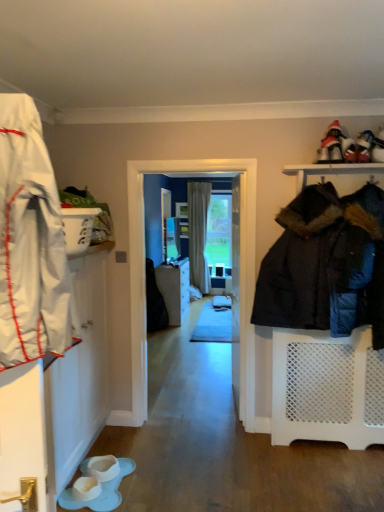
What do you see at coordinates (31, 243) in the screenshot?
I see `white fabric coat at left` at bounding box center [31, 243].

Measure the distance between point (289, 408) and camera.

The distance of point (289, 408) from camera is 9.93 feet.

Find the location of a particular element. This screenshot has height=512, width=384. dark blue quilted jacket at right is located at coordinates (326, 264).

The image size is (384, 512). What do you see at coordinates (175, 288) in the screenshot?
I see `matte gray cabinet at center` at bounding box center [175, 288].

The image size is (384, 512). What do you see at coordinates (198, 233) in the screenshot? I see `beige fabric curtain at center` at bounding box center [198, 233].

Where is `white fabric shoe at upper right, the first footwear from the top`? white fabric shoe at upper right, the first footwear from the top is located at coordinates (364, 146).

Identify the location of white glossy door at center. (236, 287).

Is dark blue quilted jacket at right looking in the opposite direction of beige fabric curtain at center?

Correct, dark blue quilted jacket at right is looking away from beige fabric curtain at center.

From the image's perspective, is dark blue quilted jacket at right above or below beige fabric curtain at center?

dark blue quilted jacket at right is below beige fabric curtain at center.

Can you confirm if dark blue quilted jacket at right is smaller than beige fabric curtain at center?

Incorrect, dark blue quilted jacket at right is not smaller in size than beige fabric curtain at center.

Is white glossy door at center closer to camera compared to matte gray cabinet at center?

Yes, white glossy door at center is closer to the viewer.

Where is `door in front of the matte gray cabinet at center`? This screenshot has height=512, width=384. door in front of the matte gray cabinet at center is located at coordinates (236, 287).

From the image's perspective, which one is positioned lower, white glossy door at center or matte gray cabinet at center?

matte gray cabinet at center, from the image's perspective.

From the image's perspective, relative to beige fabric curtain at center, is white glossy door at center above or below?

white glossy door at center is situated lower than beige fabric curtain at center in the image.

Does white glossy door at center have a greater width compared to beige fabric curtain at center?

No, white glossy door at center is not wider than beige fabric curtain at center.

Locate an element on the screen. The height and width of the screenshot is (512, 384). curtain located behind the white glossy door at center is located at coordinates point(198,233).

From their relative heights in the image, would you say white glossy door at center is taller or shorter than beige fabric curtain at center?

In the image, white glossy door at center appears to be shorter than beige fabric curtain at center.

Is white fabric shoe at upper right, the 2th footwear in the bottom-to-top sequence, next to matte gray cabinet at center?

white fabric shoe at upper right, the 2th footwear in the bottom-to-top sequence, and matte gray cabinet at center are not in contact.

Is white fabric shoe at upper right, the first footwear from the top, looking in the opposite direction of matte gray cabinet at center?

No, white fabric shoe at upper right, the first footwear from the top, is not facing the opposite direction of matte gray cabinet at center.

Does white fabric shoe at upper right, the 2th footwear in the bottom-to-top sequence, have a smaller size compared to matte gray cabinet at center?

Yes, white fabric shoe at upper right, the 2th footwear in the bottom-to-top sequence, is smaller than matte gray cabinet at center.

Can you confirm if white fabric shoe at upper right, the first footwear from the top, is taller than matte gray cabinet at center?

No.

From a real-world perspective, who is located higher, matte gray cabinet at center or white glossy door at center?

white glossy door at center.

Is matte gray cabinet at center closer to the viewer compared to white glossy door at center?

No, matte gray cabinet at center is behind white glossy door at center.

Is matte gray cabinet at center oriented towards white glossy door at center?

No.

From the image's perspective, is matte gray cabinet at center beneath white glossy door at center?

Indeed, from the image's perspective, matte gray cabinet at center is shown beneath white glossy door at center.

From the image's perspective, between white rubber boot at lower center, positioned as the second footwear in right-to-left order, and transparent glass screen door at center, who is located below?

white rubber boot at lower center, positioned as the second footwear in right-to-left order.

Could you tell me if white rubber boot at lower center, positioned as the second footwear in right-to-left order, is turned towards transparent glass screen door at center?

No, white rubber boot at lower center, positioned as the second footwear in right-to-left order, is not aimed at transparent glass screen door at center.

Considering the sizes of objects white rubber boot at lower center, placed as the first footwear when sorted from bottom to top, and transparent glass screen door at center in the image provided, who is smaller, white rubber boot at lower center, placed as the first footwear when sorted from bottom to top, or transparent glass screen door at center?

white rubber boot at lower center, placed as the first footwear when sorted from bottom to top.

Can you confirm if white rubber boot at lower center, placed as the first footwear when sorted from bottom to top, is taller than transparent glass screen door at center?

No, white rubber boot at lower center, placed as the first footwear when sorted from bottom to top, is not taller than transparent glass screen door at center.

What's the angular difference between transparent glass screen door at center and white fabric shoe at upper right, which is the 2th footwear in left-to-right order,'s facing directions?

They differ by 2.86 degrees in their facing directions.

Looking at the image, does transparent glass screen door at center seem bigger or smaller compared to white fabric shoe at upper right, arranged as the first footwear when viewed from the right?

Clearly, transparent glass screen door at center is larger in size than white fabric shoe at upper right, arranged as the first footwear when viewed from the right.

Is transparent glass screen door at center facing towards white fabric shoe at upper right, the first footwear from the top?

No, transparent glass screen door at center is not aimed at white fabric shoe at upper right, the first footwear from the top.

From a real-world perspective, is transparent glass screen door at center physically below white fabric shoe at upper right, which is the 2th footwear in left-to-right order?

Correct, in the physical world, transparent glass screen door at center is lower than white fabric shoe at upper right, which is the 2th footwear in left-to-right order.

What are the coordinates of `jacket above the beige fabric curtain at center (from a real-world perspective)` in the screenshot? It's located at (326, 264).

Find the location of a particular element. door above the matte gray cabinet at center (from the image's perspective) is located at coordinates (236, 287).

Looking at the image, which one is located closer to white glossy door at center, white fabric coat at left or white mesh shelf at right?

white mesh shelf at right is positioned closer to the anchor white glossy door at center.

Estimate the real-world distances between objects in this image. Which object is further from white rubber boot at lower center, which is counted as the first footwear, starting from the left, matte gray cabinet at center or white fabric coat at left?

A: matte gray cabinet at center.

Looking at the image, which one is located further to beige fabric curtain at center, matte gray cabinet at center or white glossy door at center?

white glossy door at center is positioned further to the anchor beige fabric curtain at center.

Considering their positions, is beige fabric curtain at center positioned further to white mesh shelf at right than matte gray cabinet at center?

Among the two, beige fabric curtain at center is located further to white mesh shelf at right.

Which object lies further to the anchor point transparent glass screen door at center, white fabric shoe at upper right, which is the 2th footwear in left-to-right order, or white glossy door at center?

Based on the image, white fabric shoe at upper right, which is the 2th footwear in left-to-right order, appears to be further to transparent glass screen door at center.

Looking at the image, which one is located closer to matte gray cabinet at center, transparent glass screen door at center or beige fabric curtain at center?

beige fabric curtain at center lies closer to matte gray cabinet at center than the other object.

Which object lies nearer to the anchor point white glossy door at center, dark blue quilted jacket at right or beige fabric curtain at center?

dark blue quilted jacket at right lies closer to white glossy door at center than the other object.

Estimate the real-world distances between objects in this image. Which object is closer to white rubber boot at lower center, placed as the first footwear when sorted from bottom to top, white fabric coat at left or transparent glass screen door at center?

Based on the image, transparent glass screen door at center appears to be nearer to white rubber boot at lower center, placed as the first footwear when sorted from bottom to top.

Find the location of a particular element. screen door located between dark blue quilted jacket at right and beige fabric curtain at center in the depth direction is located at coordinates (239, 279).

Locate an element on the screen. This screenshot has height=512, width=384. door between dark blue quilted jacket at right and matte gray cabinet at center in the front-back direction is located at coordinates (236, 287).

You are a GUI agent. You are given a task and a screenshot of the screen. Output one action in this format:
    pyautogui.click(x=<x>, y=<y>)
    Task: Click on the shelf located between white fabric shoe at upper right, which is the 2th footwear in left-to-right order, and beige fabric curtain at center in the depth direction
    Image resolution: width=384 pixels, height=512 pixels.
    Given the screenshot: What is the action you would take?
    pyautogui.click(x=327, y=388)

In order to click on cabinetry between white glossy door at center and beige fabric curtain at center in the front-back direction in this screenshot , I will do `click(175, 288)`.